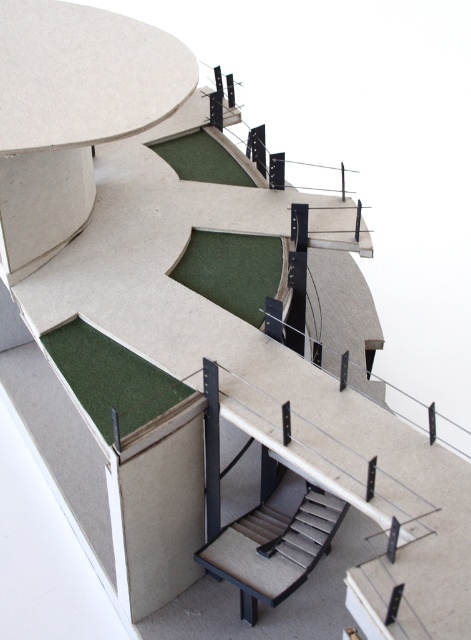
Does gray fabric stairs at center have a lesser height compared to green felt carpet at upper center?

In fact, gray fabric stairs at center may be taller than green felt carpet at upper center.

Is point (274, 588) farther from viewer compared to point (186, 156)?

No.

Which is in front, point (226, 572) or point (176, 170)?

Positioned in front is point (226, 572).

Identify the location of gray fabric stairs at center. This screenshot has width=471, height=640. (274, 545).

Can you confirm if green felt carpet at lower left is shorter than green felt carpet at upper center?

In fact, green felt carpet at lower left may be taller than green felt carpet at upper center.

Which is behind, point (175, 397) or point (205, 152)?

The point (205, 152) is more distant.

Where is `green felt carpet at lower left`? The height and width of the screenshot is (640, 471). green felt carpet at lower left is located at coordinates (112, 380).

In the scene shown: Which is more to the left, green felt carpet at lower left or green felt carpet at center?

From the viewer's perspective, green felt carpet at lower left appears more on the left side.

Does green felt carpet at lower left have a greater width compared to green felt carpet at center?

Indeed, green felt carpet at lower left has a greater width compared to green felt carpet at center.

Based on the photo, measure the distance between point (92, 396) and camera.

They are 12.32 feet apart.

Identify the location of green felt carpet at lower left. The image size is (471, 640). (112, 380).